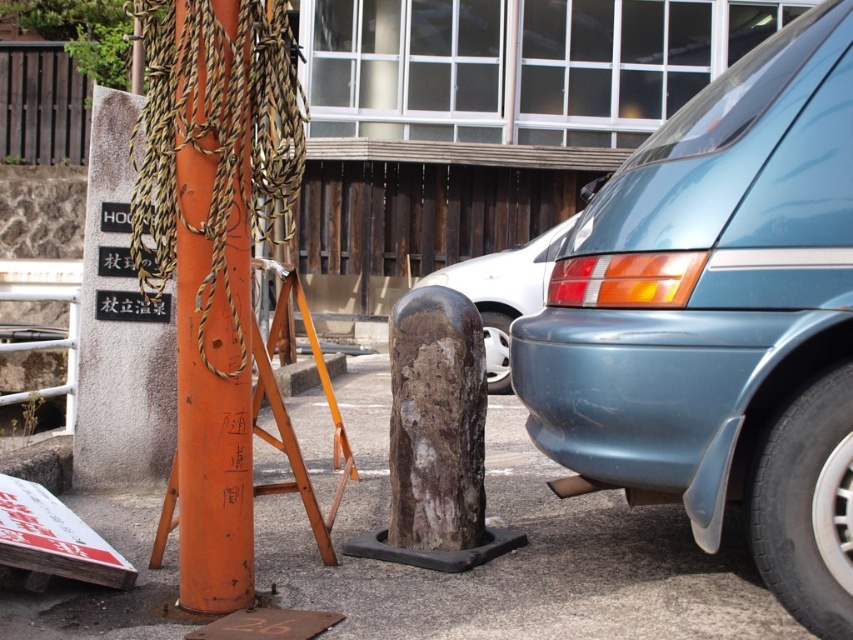
Question: Among these objects, which one is nearest to the camera?

Choices:
 (A) teal glossy minivan at right
 (B) orange painted wood post at left
 (C) matte gray bumper at center

Answer: (A)

Question: Among these points, which one is farthest from the camera?

Choices:
 (A) (646, 268)
 (B) (210, 442)
 (C) (518, 269)

Answer: (C)

Question: Among these points, which one is farthest from the camera?

Choices:
 (A) (502, 358)
 (B) (233, 509)
 (C) (779, 164)

Answer: (A)

Question: Can you confirm if teal glossy minivan at right is positioned to the right of matte gray bumper at center?

Choices:
 (A) no
 (B) yes

Answer: (B)

Question: Is teal glossy minivan at right further to camera compared to orange painted wood post at left?

Choices:
 (A) no
 (B) yes

Answer: (A)

Question: Is teal glossy minivan at right to the left of orange painted wood post at left from the viewer's perspective?

Choices:
 (A) no
 (B) yes

Answer: (A)